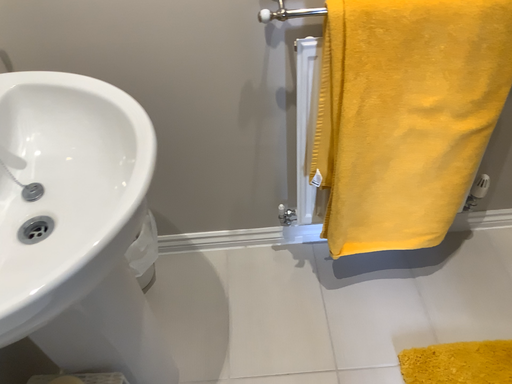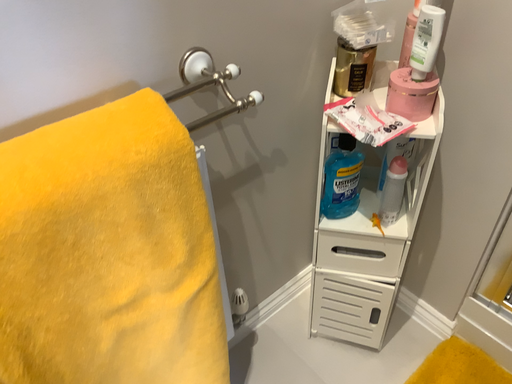
Question: Which way did the camera rotate in the video?

Choices:
 (A) rotated downward
 (B) rotated upward

Answer: (B)